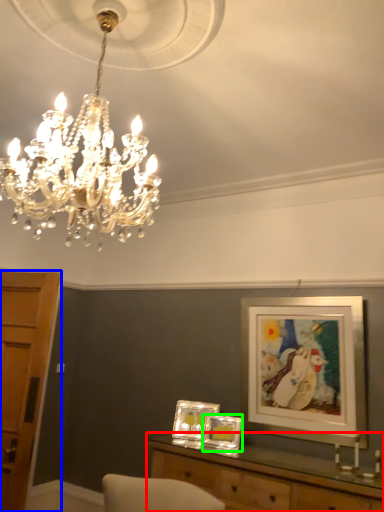
Question: Estimate the real-world distances between objects in this image. Which object is farther from table (highlighted by a red box), cabinetry (highlighted by a blue box) or picture frame (highlighted by a green box)?

Choices:
 (A) cabinetry
 (B) picture frame

Answer: (A)